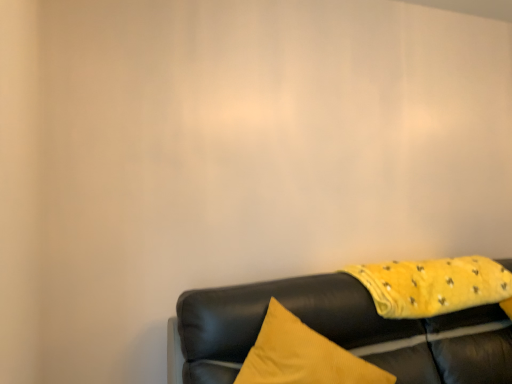
Question: From their relative heights in the image, would you say yellow soft fabric blanket at lower right is taller or shorter than leather couch at lower right?

Choices:
 (A) tall
 (B) short

Answer: (B)

Question: From the image's perspective, is yellow soft fabric blanket at lower right located above or below leather couch at lower right?

Choices:
 (A) below
 (B) above

Answer: (B)

Question: Is yellow soft fabric blanket at lower right wider or thinner than leather couch at lower right?

Choices:
 (A) thin
 (B) wide

Answer: (A)

Question: Is leather couch at lower right bigger or smaller than yellow soft fabric blanket at lower right?

Choices:
 (A) big
 (B) small

Answer: (A)

Question: Is leather couch at lower right situated inside yellow soft fabric blanket at lower right or outside?

Choices:
 (A) outside
 (B) inside

Answer: (A)

Question: Based on their positions, is leather couch at lower right located to the left or right of yellow soft fabric blanket at lower right?

Choices:
 (A) right
 (B) left

Answer: (B)

Question: From their relative heights in the image, would you say leather couch at lower right is taller or shorter than yellow soft fabric blanket at lower right?

Choices:
 (A) short
 (B) tall

Answer: (B)